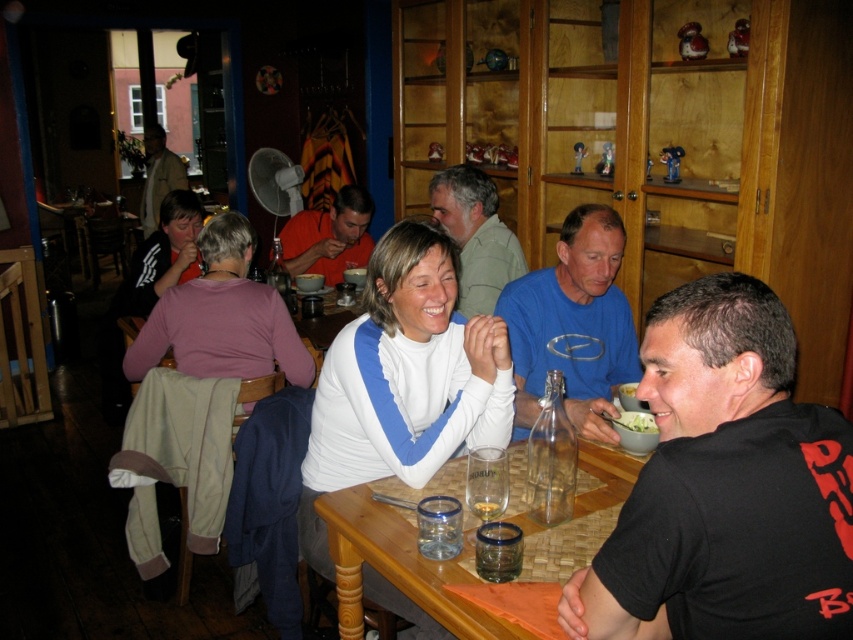
You are a server in the restaurant and need to place a new drink order on the table. The drink is taller than the clear glass at table center. Will the light brown leather jacket at upper left on the table block the placement of the drink?

The light brown leather jacket at upper left is taller than the clear glass at table center. Since the drink is taller than the clear glass at table center, it might be taller than the jacket, but the jacket itself is already occupying space on the table. There might not be enough space to place the drink without moving the jacket first.

You are a waiter in a restaurant and need to deliver a drink to the wooden table at center. You are currently standing next to the black matte shirt at lower right. Which direction should you move to reach the table?

The black matte shirt at lower right is to the right of the wooden table at center, so you should move to the left to reach the table.